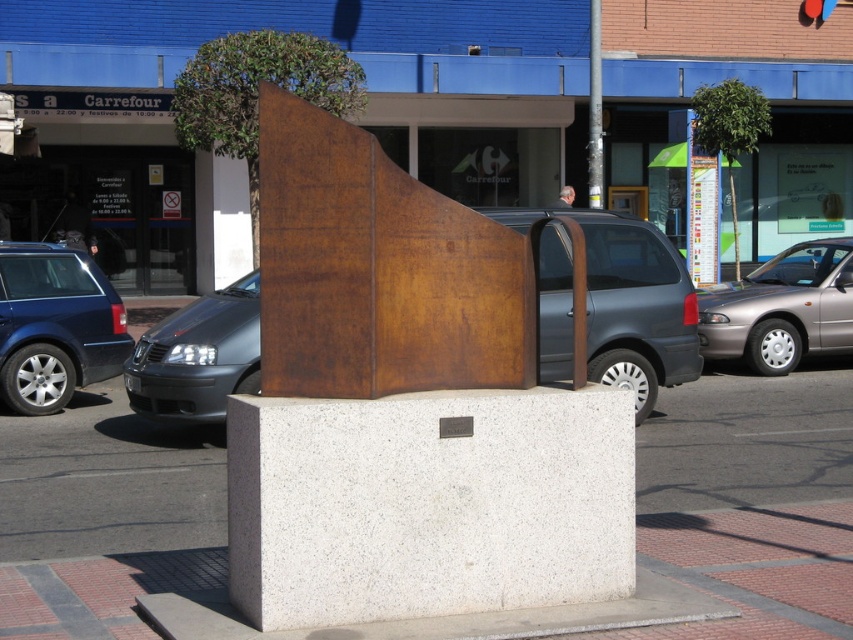
Is point (815, 296) positioned after point (592, 125)?

No, it is in front of (592, 125).

Between point (839, 339) and point (599, 170), which one is positioned in front?

Point (839, 339)

Does point (816, 308) come closer to viewer compared to point (601, 204)?

Yes, it is.

Identify the location of silver metallic car at right. The height and width of the screenshot is (640, 853). click(x=781, y=308).

Can you confirm if rusty metal sculpture at center is bigger than matte blue car at left?

Incorrect, rusty metal sculpture at center is not larger than matte blue car at left.

Is the position of rusty metal sculpture at center more distant than that of matte blue car at left?

No, it is not.

The height and width of the screenshot is (640, 853). What do you see at coordinates (379, 269) in the screenshot? I see `rusty metal sculpture at center` at bounding box center [379, 269].

What are the coordinates of `rusty metal sculpture at center` in the screenshot? It's located at (379, 269).

Does matte brown van at center have a greater width compared to matte black car at left?

In fact, matte brown van at center might be narrower than matte black car at left.

Between point (589, 376) and point (256, 362), which one is positioned in front?

Point (589, 376) is in front.

Locate an element on the screen. This screenshot has width=853, height=640. matte brown van at center is located at coordinates (630, 301).